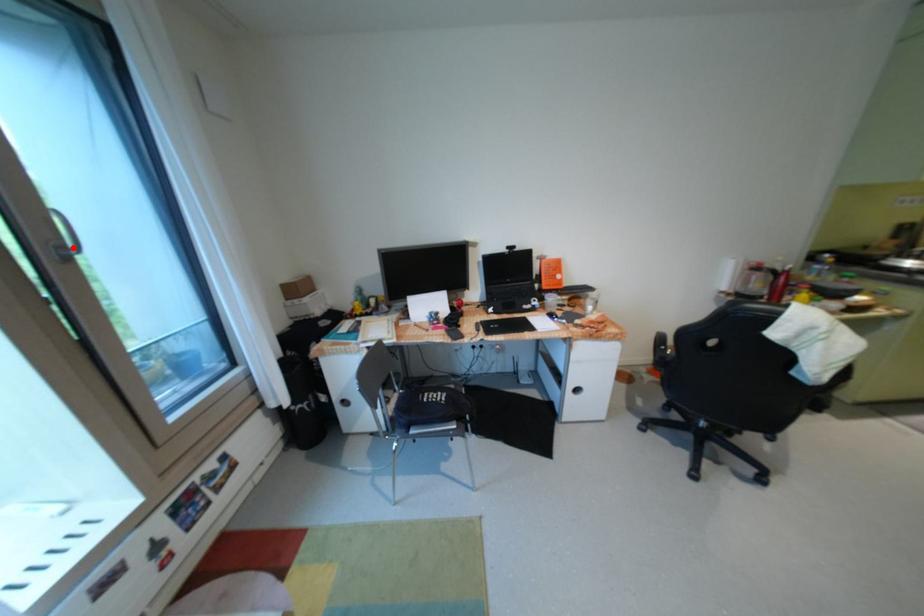
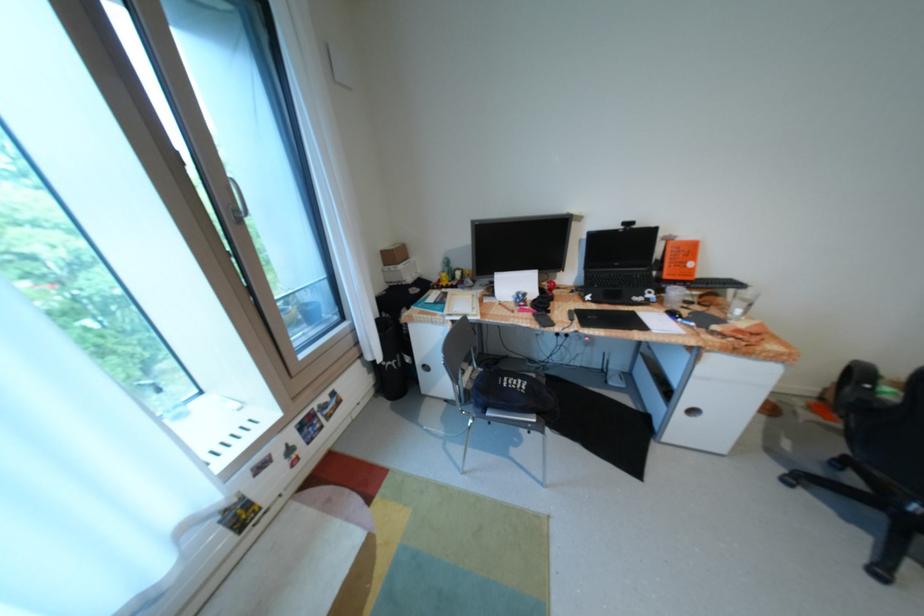
The point at the highlighted location is marked in the first image. Where is the corresponding point in the second image?

(247, 211)